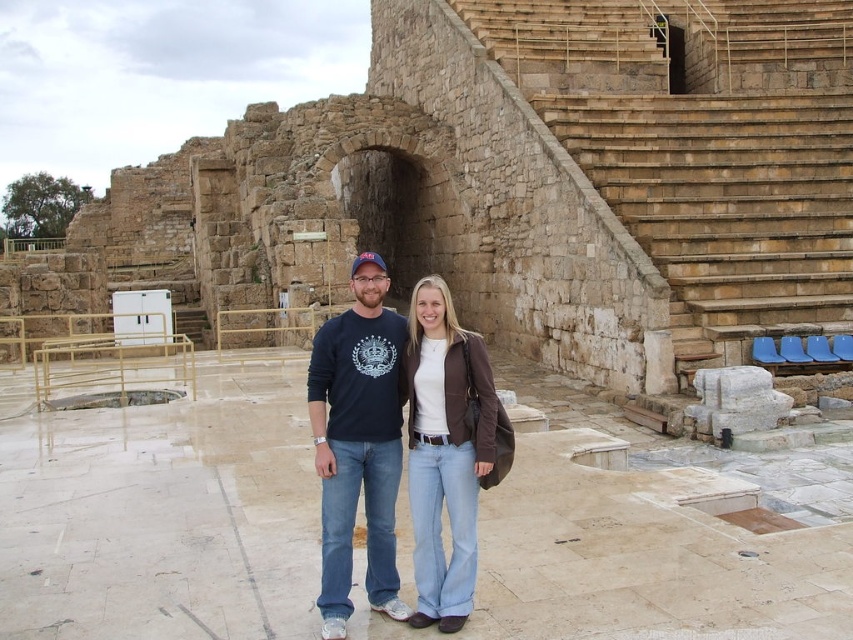
Question: Which of these objects is positioned closest to the brown leather jacket at center?

Choices:
 (A) matte blue sweatshirt at center
 (B) brown stone stairs at upper right

Answer: (A)

Question: Can you confirm if brown stone stairs at upper right is wider than brown leather jacket at center?

Choices:
 (A) yes
 (B) no

Answer: (A)

Question: Does matte blue sweatshirt at center appear on the left side of brown leather jacket at center?

Choices:
 (A) no
 (B) yes

Answer: (B)

Question: Among these objects, which one is farthest from the camera?

Choices:
 (A) brown leather jacket at center
 (B) matte blue sweatshirt at center
 (C) brown stone stairs at upper right

Answer: (C)

Question: Is brown stone stairs at upper right above matte blue sweatshirt at center?

Choices:
 (A) no
 (B) yes

Answer: (B)

Question: Among these objects, which one is nearest to the camera?

Choices:
 (A) brown stone stairs at upper right
 (B) matte blue sweatshirt at center

Answer: (B)